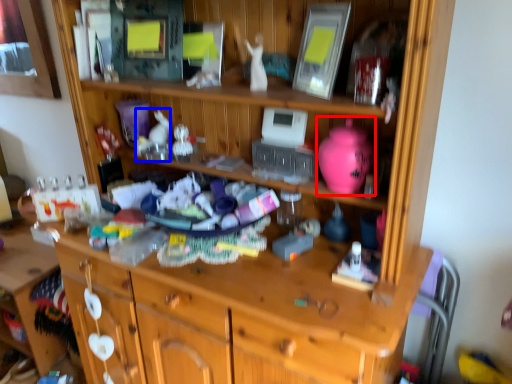
Question: Which object is further to the camera taking this photo, toy (highlighted by a red box) or toy (highlighted by a blue box)?

Choices:
 (A) toy
 (B) toy

Answer: (B)